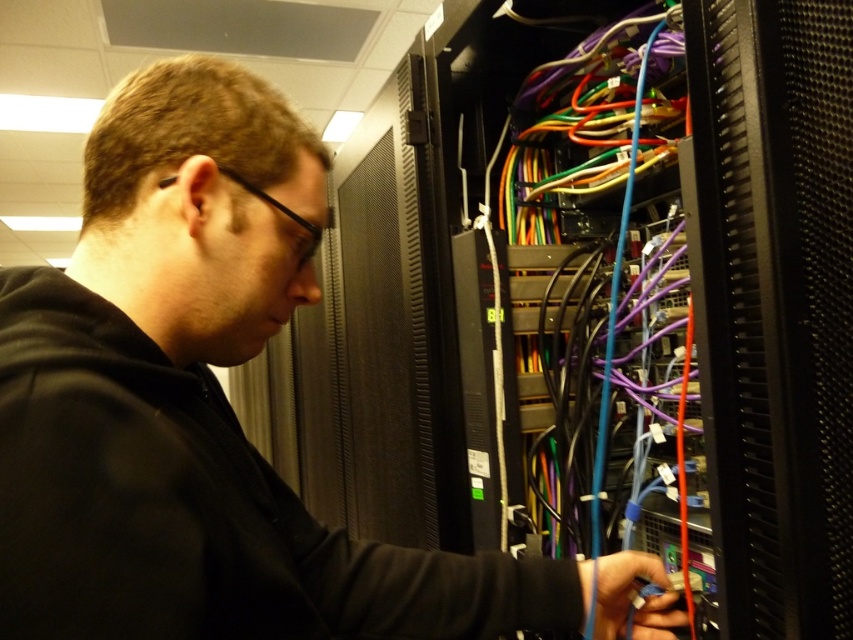
You are an IT technician entering a server room and see the black matte jacket at center and the black textured server at center. Which object is closer to the floor?

The black matte jacket at center is below the black textured server at center, so the black matte jacket at center is closer to the floor.

You are an IT technician in the server room and need to access two points labeled as point (555,604) and point (827,592). Which point is closer to you?

Point (555,604) is closer to you because it is further to the viewer than point (827,592).

Consider the image. You are an IT technician in a server room. You need to determine which item is larger between the black matte jacket at center and the black textured server at center. Based on the scene, which one is bigger?

The black matte jacket at center is bigger than the black textured server at center according to the description.